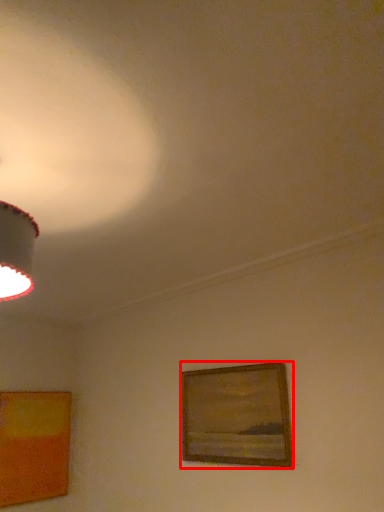
Question: Observing the image, what is the correct spatial positioning of picture frame (annotated by the red box) in reference to picture frame?

Choices:
 (A) right
 (B) left

Answer: (A)